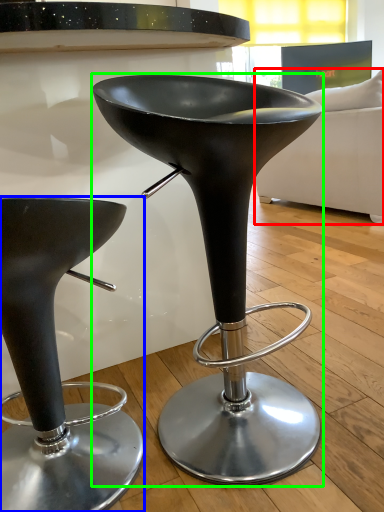
Question: Estimate the real-world distances between objects in this image. Which object is farther from couch (highlighted by a red box), stool (highlighted by a blue box) or stool (highlighted by a green box)?

Choices:
 (A) stool
 (B) stool

Answer: (A)